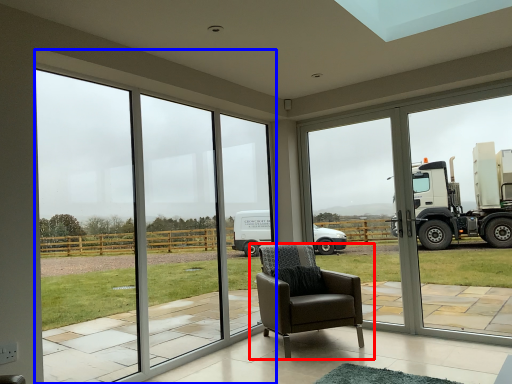
Question: Which of the following is the farthest to the observer, chair (highlighted by a red box) or window (highlighted by a blue box)?

Choices:
 (A) chair
 (B) window

Answer: (A)